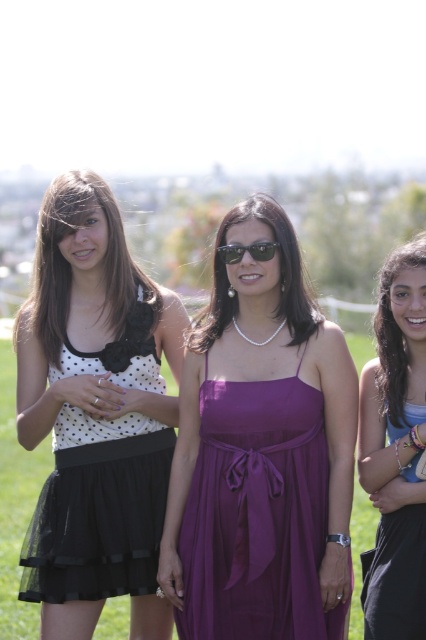
Does matte purple dress at right appear over sunglasses at center?

Correct, matte purple dress at right is located above sunglasses at center.

Who is taller, matte purple dress at right or sunglasses at center?

With more height is matte purple dress at right.

Where is `matte purple dress at right`? matte purple dress at right is located at coordinates (394, 332).

Is white dotted fabric dress at left positioned at the back of matte purple dress at right?

That is True.

Is white dotted fabric dress at left positioned in front of matte purple dress at right?

That is False.

Which is in front, point (92, 419) or point (399, 326)?

Point (399, 326) is in front.

This screenshot has width=426, height=640. Identify the location of white dotted fabric dress at left. (97, 509).

Does green grass at center appear on the right side of pearl necklace at center?

In fact, green grass at center is to the left of pearl necklace at center.

Is green grass at center positioned before pearl necklace at center?

Yes, green grass at center is closer to the viewer.

Who is more forward, (354, 628) or (287, 323)?

Point (287, 323) is in front.

Find the location of `green grass at center`. green grass at center is located at coordinates (17, 502).